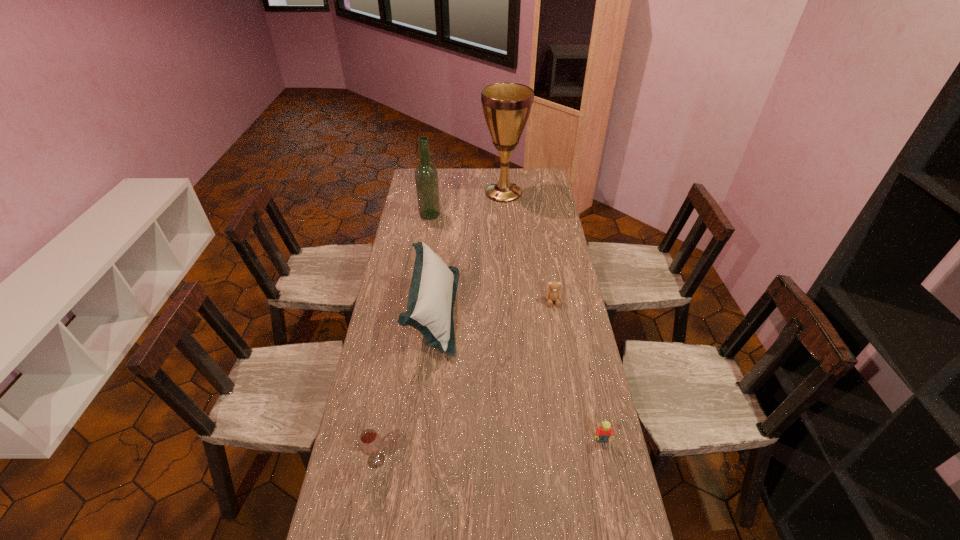
What are the coordinates of `vacant space located 0.260m on the left of the tallest object` in the screenshot? It's located at (432, 193).

Locate an element on the screen. Image resolution: width=960 pixels, height=540 pixels. vacant area located 0.160m on the back of the fifth shortest object is located at coordinates (433, 192).

I want to click on free space located on the surface of the fourth shortest object, so click(524, 310).

Where is `vacant area located on the back of the nearest object`? The image size is (960, 540). vacant area located on the back of the nearest object is located at coordinates (393, 367).

I want to click on vacant space located on the face of the second nearest object, so click(x=608, y=469).

Where is `vacant region located on the front-facing side of the fifth object from left to right`? The image size is (960, 540). vacant region located on the front-facing side of the fifth object from left to right is located at coordinates (560, 339).

Where is `object located in the far edge section of the desktop`? Image resolution: width=960 pixels, height=540 pixels. object located in the far edge section of the desktop is located at coordinates [x=506, y=106].

The image size is (960, 540). I want to click on liquor located at the left edge, so click(x=426, y=176).

The width and height of the screenshot is (960, 540). Identify the location of cushion located at the left edge. (433, 288).

Where is `wineglass that is at the left edge`? This screenshot has height=540, width=960. wineglass that is at the left edge is located at coordinates (370, 443).